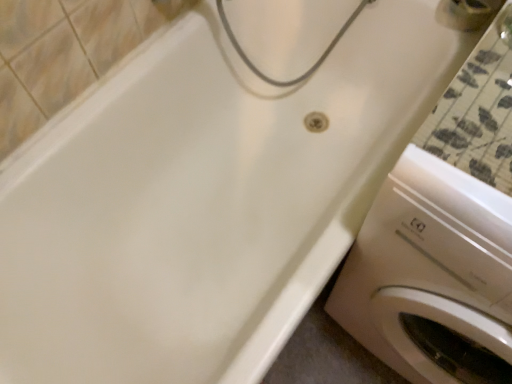
Measure the distance between point (457, 8) and camera.

3.61 feet.

What is the approximate height of metallic silver faucet at upper right?

1.51 inches.

The image size is (512, 384). What do you see at coordinates (467, 13) in the screenshot?
I see `metallic silver faucet at upper right` at bounding box center [467, 13].

I want to click on metallic silver faucet at upper right, so click(x=467, y=13).

Describe the element at coordinates (432, 276) in the screenshot. This screenshot has width=512, height=384. I see `white glossy washing machine at lower right` at that location.

Locate an element on the screen. The image size is (512, 384). white glossy washing machine at lower right is located at coordinates (432, 276).

Where is `metallic silver faucet at upper right`? metallic silver faucet at upper right is located at coordinates (467, 13).

Considering the positions of objects white glossy washing machine at lower right and metallic silver faucet at upper right in the image provided, who is more to the left, white glossy washing machine at lower right or metallic silver faucet at upper right?

Positioned to the left is white glossy washing machine at lower right.

Which is in front, white glossy washing machine at lower right or metallic silver faucet at upper right?

white glossy washing machine at lower right.

Does point (395, 167) lie behind point (445, 6)?

No, it is not.

From the image's perspective, which one is positioned higher, white glossy washing machine at lower right or metallic silver faucet at upper right?

metallic silver faucet at upper right.

From a real-world perspective, is white glossy washing machine at lower right over metallic silver faucet at upper right?

No.

Can you confirm if white glossy washing machine at lower right is wider than metallic silver faucet at upper right?

Indeed, white glossy washing machine at lower right has a greater width compared to metallic silver faucet at upper right.

Considering the relative sizes of white glossy washing machine at lower right and metallic silver faucet at upper right in the image provided, is white glossy washing machine at lower right taller than metallic silver faucet at upper right?

Yes, white glossy washing machine at lower right is taller than metallic silver faucet at upper right.

Considering the relative sizes of white glossy washing machine at lower right and metallic silver faucet at upper right in the image provided, is white glossy washing machine at lower right bigger than metallic silver faucet at upper right?

Yes.

Does white glossy washing machine at lower right contain metallic silver faucet at upper right?

No, metallic silver faucet at upper right is not a part of white glossy washing machine at lower right.

Would you say white glossy washing machine at lower right is a long distance from metallic silver faucet at upper right?

No, there isn't a large distance between white glossy washing machine at lower right and metallic silver faucet at upper right.

Is white glossy washing machine at lower right aimed at metallic silver faucet at upper right?

No, white glossy washing machine at lower right does not turn towards metallic silver faucet at upper right.

How many degrees apart are the facing directions of white glossy washing machine at lower right and metallic silver faucet at upper right?

The facing directions of white glossy washing machine at lower right and metallic silver faucet at upper right are 1.22 degrees apart.

This screenshot has width=512, height=384. What are the coordinates of `faucet above the white glossy washing machine at lower right (from the image's perspective)` in the screenshot? It's located at (467, 13).

Is metallic silver faucet at upper right to the right of white glossy washing machine at lower right from the viewer's perspective?

Yes.

Is metallic silver faucet at upper right behind white glossy washing machine at lower right?

Yes, metallic silver faucet at upper right is behind white glossy washing machine at lower right.

Based on the photo, which is more distant, (x=456, y=29) or (x=386, y=302)?

The point (x=456, y=29) is farther.

From the image's perspective, is metallic silver faucet at upper right located beneath white glossy washing machine at lower right?

No.

From a real-world perspective, between metallic silver faucet at upper right and white glossy washing machine at lower right, who is vertically higher?

metallic silver faucet at upper right, from a real-world perspective.

Can you confirm if metallic silver faucet at upper right is wider than white glossy washing machine at lower right?

No, metallic silver faucet at upper right is not wider than white glossy washing machine at lower right.

In terms of height, does metallic silver faucet at upper right look taller or shorter compared to white glossy washing machine at lower right?

In the image, metallic silver faucet at upper right appears to be shorter than white glossy washing machine at lower right.

From the picture: Between metallic silver faucet at upper right and white glossy washing machine at lower right, which one has smaller size?

With smaller size is metallic silver faucet at upper right.

Is metallic silver faucet at upper right located outside white glossy washing machine at lower right?

That's correct, metallic silver faucet at upper right is outside of white glossy washing machine at lower right.

Are metallic silver faucet at upper right and white glossy washing machine at lower right far apart?

They are positioned close to each other.

Is metallic silver faucet at upper right oriented towards white glossy washing machine at lower right?

No.

How many degrees apart are the facing directions of metallic silver faucet at upper right and white glossy washing machine at lower right?

There is a 1.22-degree angle between the facing directions of metallic silver faucet at upper right and white glossy washing machine at lower right.

The height and width of the screenshot is (384, 512). In order to click on washing machine in front of the metallic silver faucet at upper right in this screenshot , I will do `click(432, 276)`.

This screenshot has height=384, width=512. In the image, there is a white glossy washing machine at lower right. Identify the location of faucet above it (from the image's perspective). coord(467,13).

This screenshot has height=384, width=512. Find the location of `washing machine below the metallic silver faucet at upper right (from the image's perspective)`. washing machine below the metallic silver faucet at upper right (from the image's perspective) is located at coordinates (432, 276).